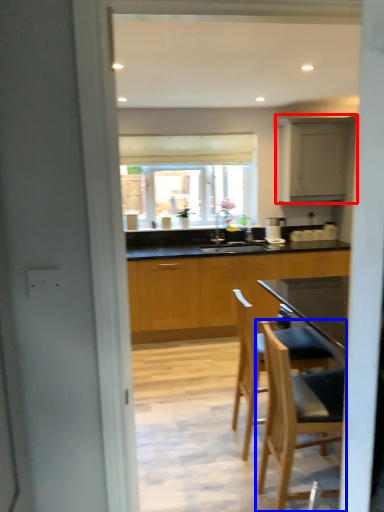
Question: Which object appears closest to the camera in this image, cabinetry (highlighted by a red box) or chair (highlighted by a blue box)?

Choices:
 (A) cabinetry
 (B) chair

Answer: (B)